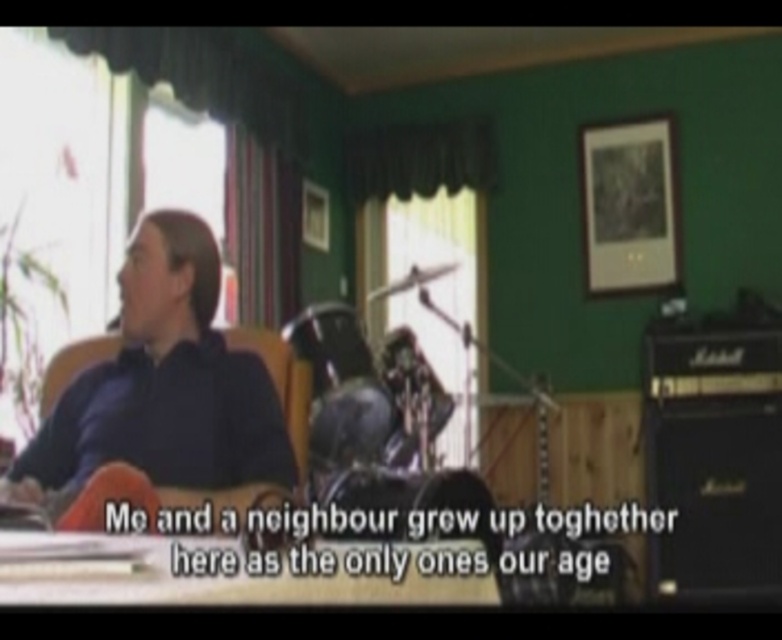
You are setting up a music room and need to place a new speaker system. The speaker system requires a space that is higher than the black matte amplifier at lower right but lower than the matte black chair at left. Is there a suitable spot available in the room?

The black matte amplifier at lower right is located below the matte black chair at left, so there is a suitable space between them where the speaker system can be placed as it needs to be higher than the amplifier but lower than the chair.